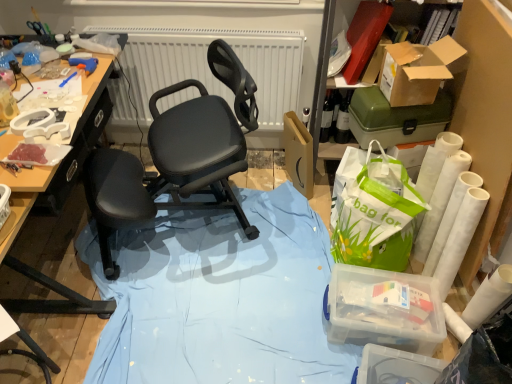
Question: Looking at their shapes, would you say transparent plastic container at lower right, marked as the 1th box in a bottom-to-top arrangement, is wider or thinner than cardboard box at upper right, which is the 4th box from bottom to top?

Choices:
 (A) thin
 (B) wide

Answer: (A)

Question: Would you say transparent plastic container at lower right, marked as the 1th box in a bottom-to-top arrangement, is inside or outside cardboard box at upper right, which is the 4th box from bottom to top?

Choices:
 (A) inside
 (B) outside

Answer: (B)

Question: Which is farther from the transparent plastic container at lower right, which appears as the fourth box when viewed from the top?

Choices:
 (A) blue matte fabric at center
 (B) matte black bottle at upper right
 (C) matte blue glue gun at upper left
 (D) white plastic tray at upper left
 (E) cardboard box at upper right, the first box from the top

Answer: (C)

Question: Which object is the farthest from the matte blue glue gun at upper left?

Choices:
 (A) green plastic toolbox at upper right, positioned as the 3th box in bottom-to-top order
 (B) black mesh chair at center
 (C) white plastic tray at upper left
 (D) cardboard box at upper right, the first box from the top
 (E) transparent plastic container at lower right, marked as the 1th box in a bottom-to-top arrangement

Answer: (E)